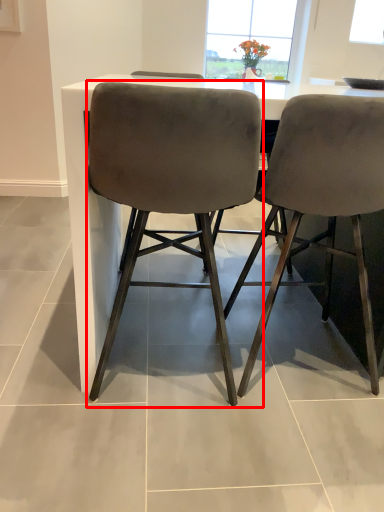
Question: From the image's perspective, where is chair (annotated by the red box) located in relation to chair in the image?

Choices:
 (A) below
 (B) above

Answer: (A)